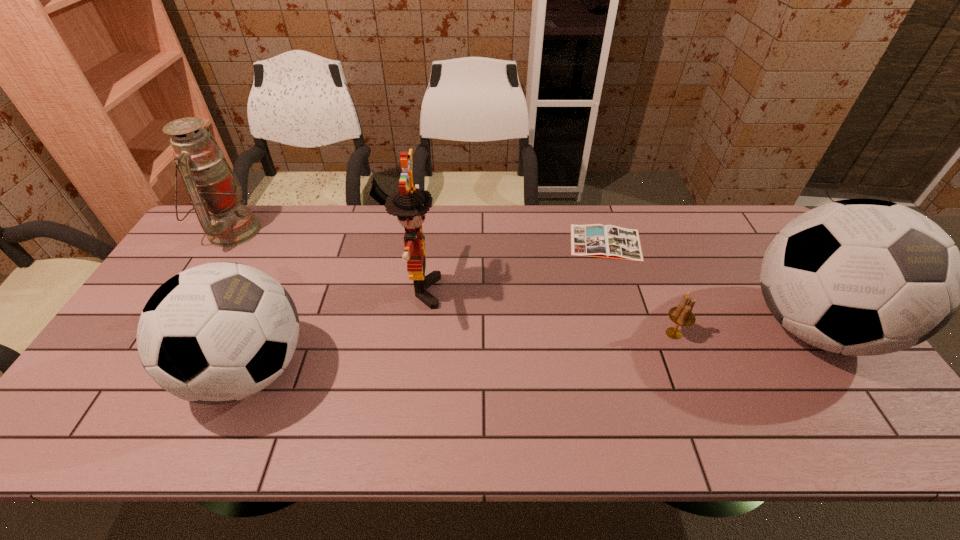
At what (x,y) coordinates should I click in order to perform the action: click on the left soccer ball. Please return your answer as a coordinate pair (x, y). Image resolution: width=960 pixels, height=540 pixels. Looking at the image, I should click on (220, 332).

The image size is (960, 540). I want to click on the third shortest object, so click(x=220, y=332).

Find the location of a particular element. This screenshot has width=960, height=540. the right soccer ball is located at coordinates (x=861, y=277).

Locate an element on the screen. The height and width of the screenshot is (540, 960). the taller soccer ball is located at coordinates (861, 277).

Identify the location of the leftmost object. This screenshot has height=540, width=960. (215, 192).

Identify the location of nutcracker. (410, 204).

Locate an element on the screen. book is located at coordinates (595, 240).

Identify the location of the fifth tallest object. (682, 315).

In order to click on vacant region located on the main logo of the second object from left to right in this screenshot , I will do `click(465, 371)`.

You are a GUI agent. You are given a task and a screenshot of the screen. Output one action in this format:
    pyautogui.click(x=<x>, y=<y>)
    Task: Click on the free space located 0.190m on the front of the leftmost object
    
    Given the screenshot: What is the action you would take?
    coord(187,301)